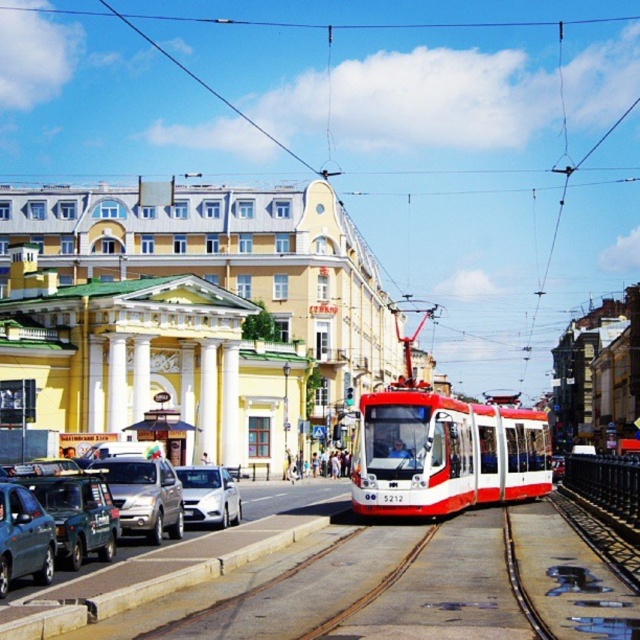
Question: Which point is closer to the camera?

Choices:
 (A) green matte van at lower left
 (B) metallic silver van at left

Answer: (B)

Question: Based on their relative distances, which object is farther from the white glossy sedan at center?

Choices:
 (A) green matte van at lower left
 (B) silver metallic suv at center-left

Answer: (A)

Question: Is red/white polished tram at center positioned before white glossy sedan at center?

Choices:
 (A) no
 (B) yes

Answer: (A)

Question: Can you confirm if silver metallic suv at center-left is bigger than metallic silver car at left?

Choices:
 (A) no
 (B) yes

Answer: (A)

Question: Is metallic silver van at left to the right of white glossy sedan at center from the viewer's perspective?

Choices:
 (A) yes
 (B) no

Answer: (B)

Question: Estimate the real-world distances between objects in this image. Which object is closer to the red/white polished tram at center?

Choices:
 (A) white glossy sedan at center
 (B) green matte van at lower left
 (C) metallic silver van at left
 (D) silver metallic suv at center-left

Answer: (A)